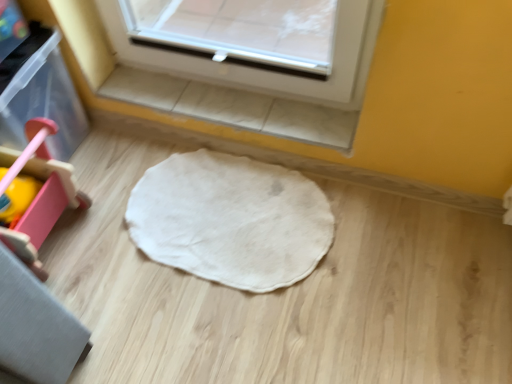
Question: From a real-world perspective, is white soft mat at center physically located above or below pink plastic walker at left?

Choices:
 (A) below
 (B) above

Answer: (A)

Question: From their relative heights in the image, would you say white soft mat at center is taller or shorter than pink plastic walker at left?

Choices:
 (A) short
 (B) tall

Answer: (A)

Question: Is white soft mat at center bigger or smaller than pink plastic walker at left?

Choices:
 (A) small
 (B) big

Answer: (A)

Question: Is pink plastic walker at left bigger or smaller than white soft mat at center?

Choices:
 (A) small
 (B) big

Answer: (B)

Question: In the image, is pink plastic walker at left on the left side or the right side of white soft mat at center?

Choices:
 (A) right
 (B) left

Answer: (B)

Question: Is pink plastic walker at left wider or thinner than white soft mat at center?

Choices:
 (A) wide
 (B) thin

Answer: (B)

Question: From a real-world perspective, is pink plastic walker at left physically located above or below white soft mat at center?

Choices:
 (A) above
 (B) below

Answer: (A)